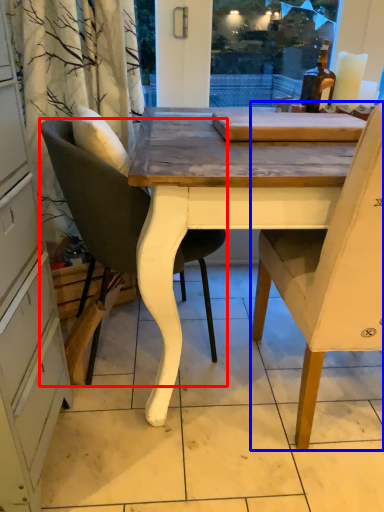
Question: Which of the following is the farthest to the observer, chair (highlighted by a red box) or chair (highlighted by a blue box)?

Choices:
 (A) chair
 (B) chair

Answer: (A)